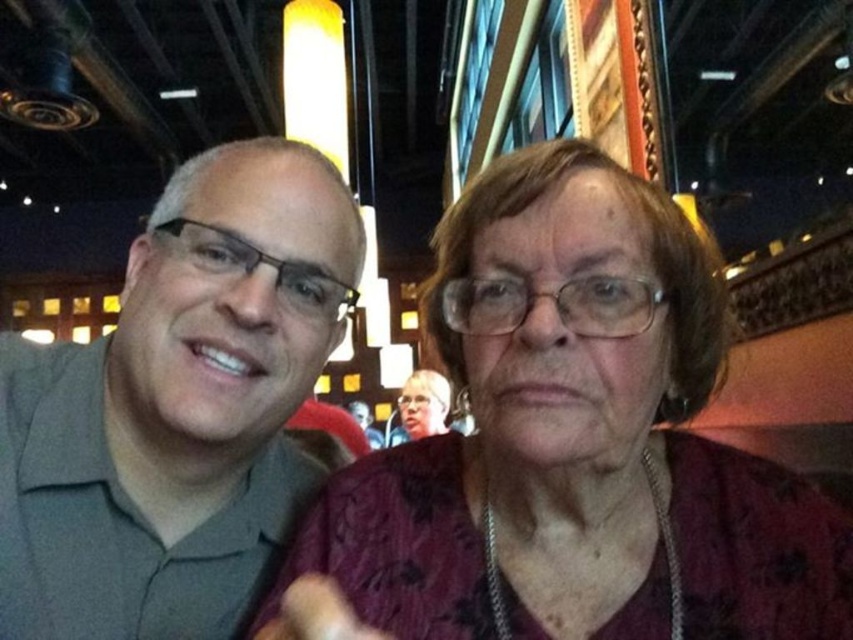
Which is more to the right, gray matte shirt at left or matte purple blouse at center?

matte purple blouse at center

Can you confirm if gray matte shirt at left is positioned below matte purple blouse at center?

Actually, gray matte shirt at left is above matte purple blouse at center.

Does point (44, 554) lie in front of point (440, 381)?

Yes.

Where is `gray matte shirt at left`? The image size is (853, 640). gray matte shirt at left is located at coordinates (x=177, y=408).

Is point (616, 621) closer to viewer compared to point (177, 499)?

Yes, it is.

Consider the image. Is maroon fabric dress at center thinner than gray matte shirt at left?

Incorrect, maroon fabric dress at center's width is not less than gray matte shirt at left's.

Locate an element on the screen. maroon fabric dress at center is located at coordinates (573, 442).

In order to click on maroon fabric dress at center in this screenshot , I will do `click(573, 442)`.

Is maroon fabric dress at center below matte purple blouse at center?

Actually, maroon fabric dress at center is above matte purple blouse at center.

Is point (538, 150) closer to viewer compared to point (444, 406)?

Yes, point (538, 150) is in front of point (444, 406).

This screenshot has height=640, width=853. What do you see at coordinates (573, 442) in the screenshot?
I see `maroon fabric dress at center` at bounding box center [573, 442].

Where is `maroon fabric dress at center`? This screenshot has height=640, width=853. maroon fabric dress at center is located at coordinates (573, 442).